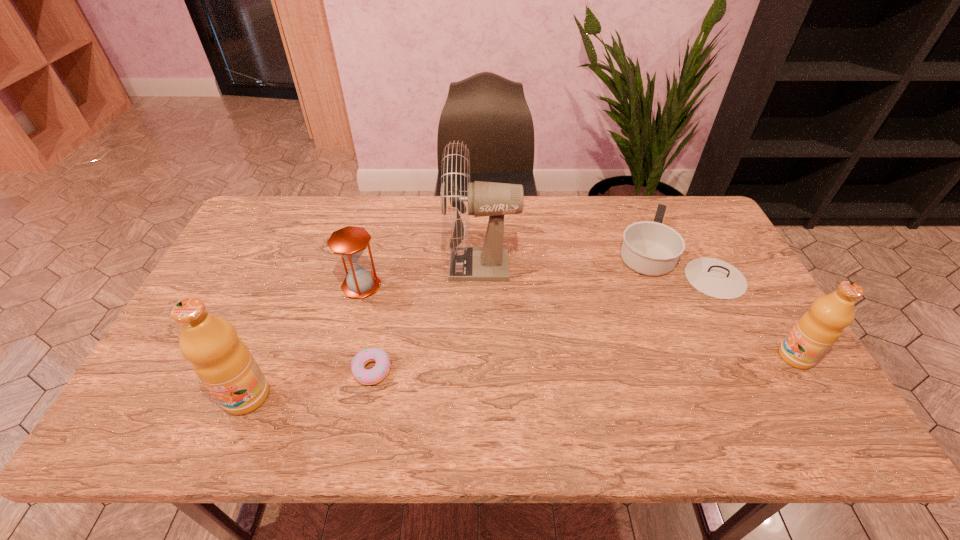
Identify the location of blank space located 0.240m on the front label of the shorter fruit juice. (684, 356).

The image size is (960, 540). What are the coordinates of `free region located 0.210m on the front label of the shorter fruit juice` in the screenshot? It's located at (696, 356).

Locate an element on the screen. The width and height of the screenshot is (960, 540). free space located on the front of the fifth tallest object is located at coordinates (702, 316).

Find the location of a particular element. vacant space located 0.360m on the left of the fourth tallest object is located at coordinates (219, 286).

Where is `vacant space located 0.250m on the air flow direction of the fan`? The height and width of the screenshot is (540, 960). vacant space located 0.250m on the air flow direction of the fan is located at coordinates (365, 265).

Image resolution: width=960 pixels, height=540 pixels. Find the location of `vacant space located 0.370m on the air flow direction of the fan`. vacant space located 0.370m on the air flow direction of the fan is located at coordinates point(325,265).

This screenshot has height=540, width=960. In order to click on vacant space located on the air flow direction of the fan in this screenshot , I will do `click(365, 265)`.

At what (x,y) coordinates should I click in order to perform the action: click on vacant space located on the back of the shortest object. Please return your answer as a coordinate pair (x, y). Looking at the image, I should click on (396, 251).

Where is `saucepan located in the far edge section of the desktop`? The height and width of the screenshot is (540, 960). saucepan located in the far edge section of the desktop is located at coordinates (x=651, y=248).

The image size is (960, 540). Find the location of `fan that is at the far edge`. fan that is at the far edge is located at coordinates (489, 262).